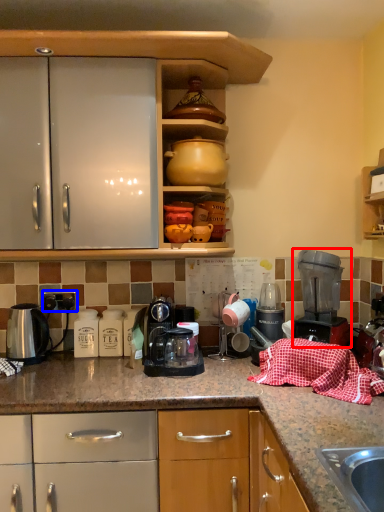
Question: Which of the following is the closest to the observer, home appliance (highlighted by a red box) or electric outlet (highlighted by a blue box)?

Choices:
 (A) home appliance
 (B) electric outlet

Answer: (A)